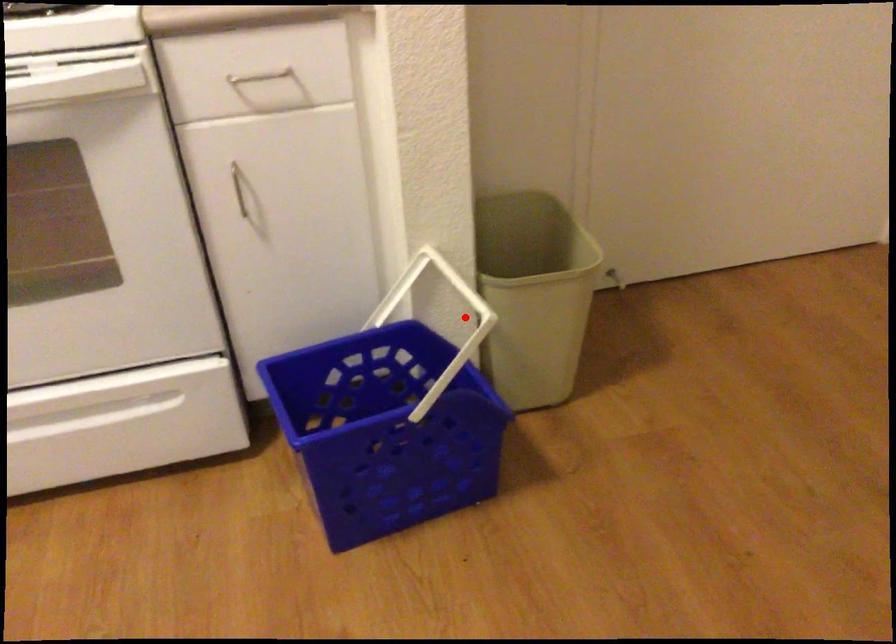
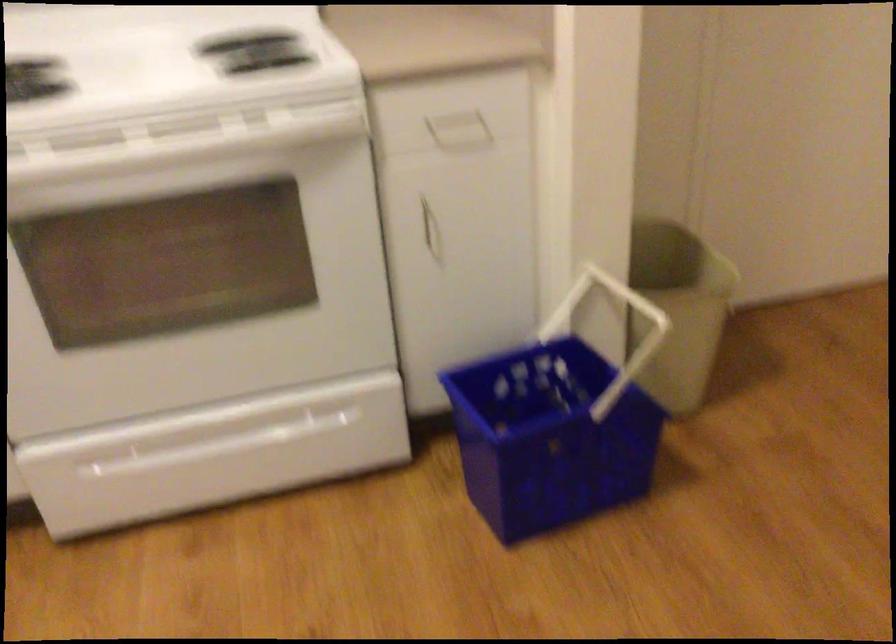
Find the pixel in the second image that matches the highlighted location in the first image.

(616, 330)